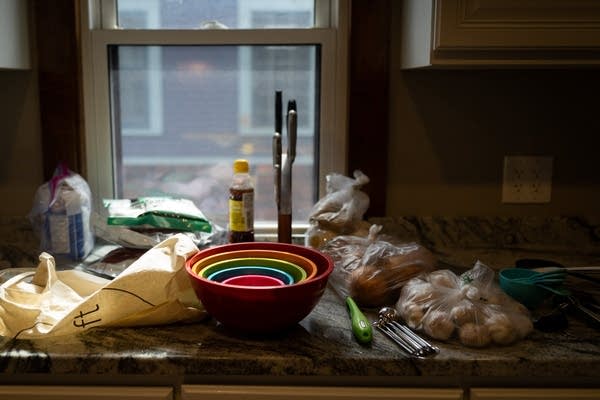
Where is `kitchen countertop`? kitchen countertop is located at coordinates (238, 351).